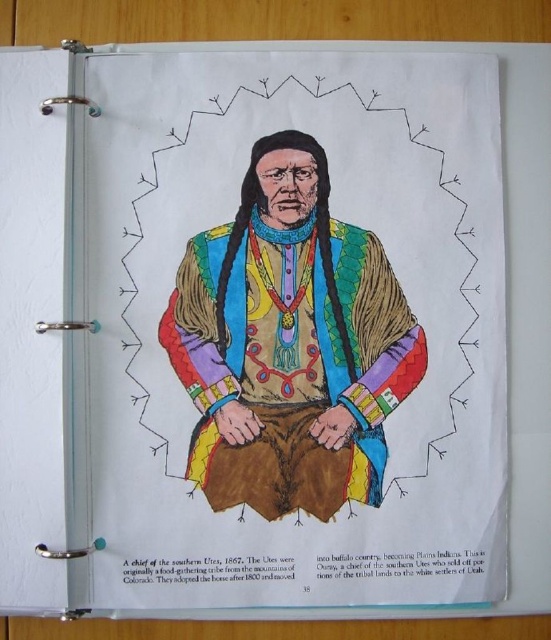
Based on the scene description, can you determine which object is wider between the multicolored fur vest at center and the black paper at bottom?

The multicolored fur vest at center is wider than the black paper at bottom according to the description.

Based on the scene described, which object occupies a larger vertical space in the image? Please refer to the multicolored fur vest at center and the black paper at bottom in your answer.

The multicolored fur vest at center is much taller than the black paper at bottom, meaning it occupies a larger vertical space in the image.

You are examining the illustration of the chief from the southern Utes tribe. There are two points marked on the image at coordinates point [302,449] and point [197,570]. Which point is closer to you as you look at the illustration?

Point [302,449] is further to the camera than point [197,570], so the point closer to you is point [197,570].